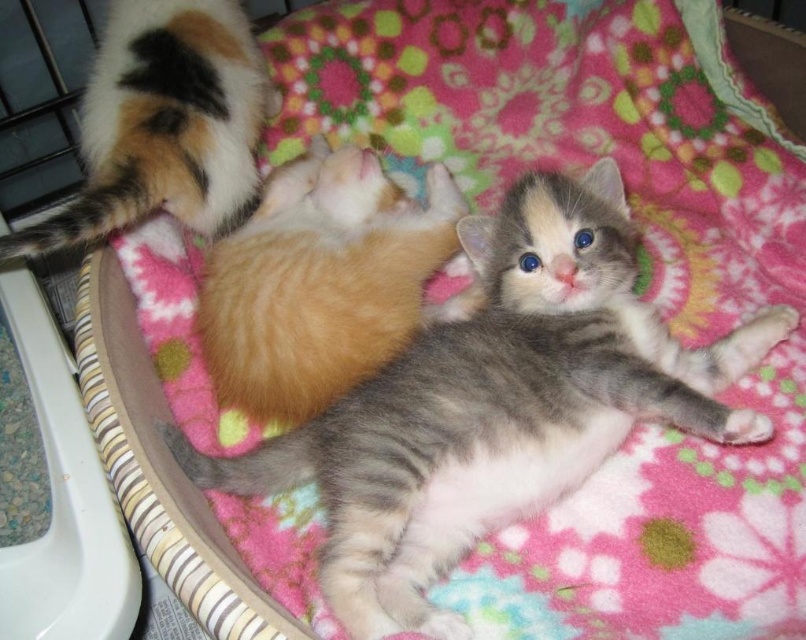
Who is more forward, (426, 374) or (272, 346)?

Point (426, 374) is in front.

Who is higher up, fluffy gray kitten at center or orange fur cat at center?

orange fur cat at center is above.

Measure the distance between point (542,193) and camera.

1.20 meters

Identify the location of fluffy gray kitten at center. (495, 403).

Between orange fur cat at center and calico fur tail at upper left, which one appears on the left side from the viewer's perspective?

Positioned to the left is calico fur tail at upper left.

Does orange fur cat at center lie behind calico fur tail at upper left?

Yes.

Is point (248, 372) positioned before point (273, 109)?

Yes, it is.

Locate an element on the screen. orange fur cat at center is located at coordinates (320, 282).

Is point (609, 243) closer to camera compared to point (202, 131)?

Yes, point (609, 243) is in front of point (202, 131).

Does fluffy gray kitten at center have a smaller size compared to calico fur tail at upper left?

No, fluffy gray kitten at center is not smaller than calico fur tail at upper left.

Is point (360, 568) closer to viewer compared to point (222, 124)?

Yes, it is in front of point (222, 124).

What are the coordinates of `fluffy gray kitten at center` in the screenshot? It's located at (495, 403).